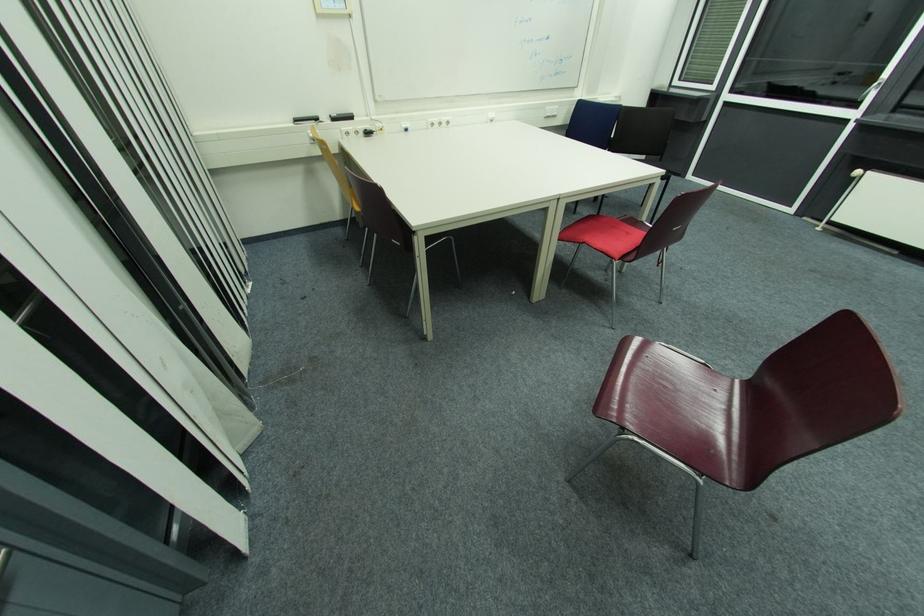
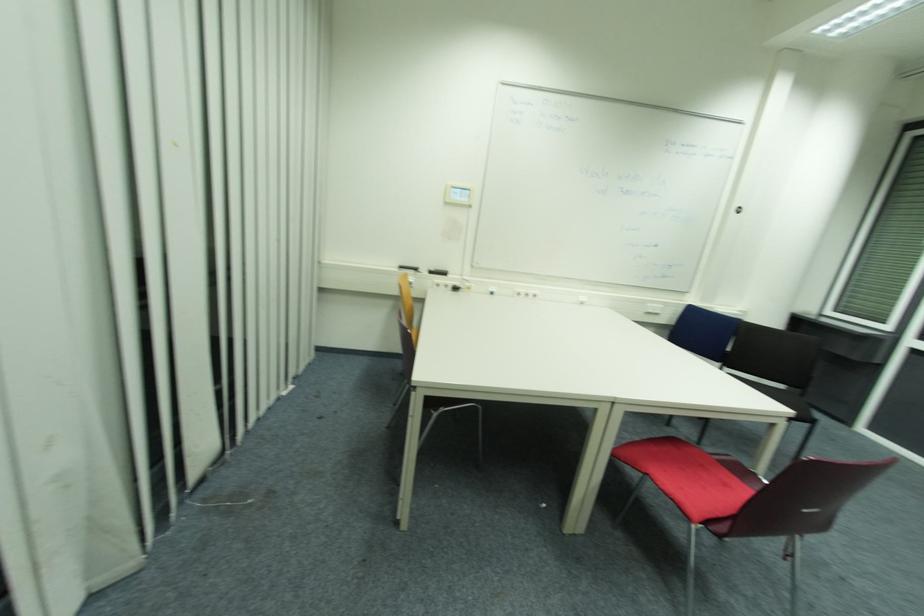
Locate, in the second image, the point that corresponds to (x=337, y=120) in the first image.

(433, 273)